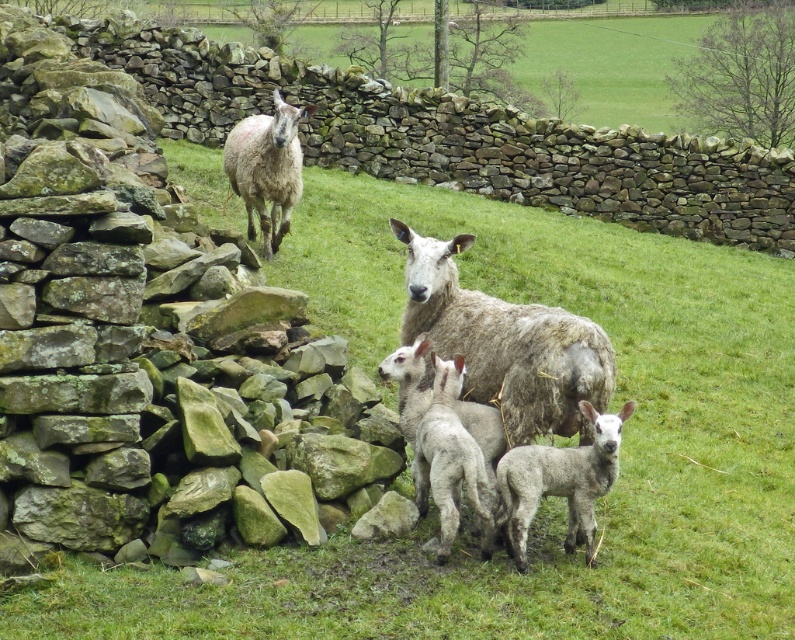
Question: Which point is closer to the camera?

Choices:
 (A) fuzzy white lamb at center
 (B) gray woolen sheep at center
 (C) fuzzy white sheep at upper left
 (D) gray woolen lamb at center

Answer: (A)

Question: Which of the following is the closest to the observer?

Choices:
 (A) (270, 147)
 (B) (569, 545)
 (C) (417, 456)
 (D) (446, 243)

Answer: (B)

Question: Is fuzzy white lamb at center above gray woolen lamb at center?

Choices:
 (A) yes
 (B) no

Answer: (B)

Question: Which of these objects is positioned closest to the fuzzy white sheep at upper left?

Choices:
 (A) fuzzy white lamb at center
 (B) gray woolen sheep at center
 (C) gray woolen lamb at center

Answer: (B)

Question: Can you confirm if fuzzy white lamb at center is bigger than fuzzy white sheep at upper left?

Choices:
 (A) no
 (B) yes

Answer: (A)

Question: Can you confirm if gray woolen sheep at center is smaller than fuzzy white sheep at upper left?

Choices:
 (A) yes
 (B) no

Answer: (A)